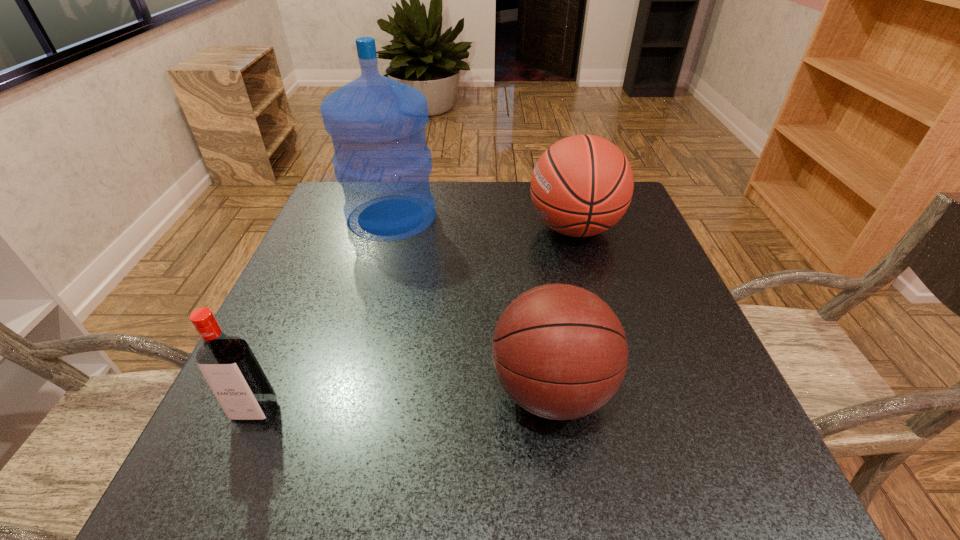
At what (x,y) coordinates should I click in order to perform the action: click on vacant space at the left edge of the desktop. Please return your answer as a coordinate pair (x, y). The image size is (960, 540). Looking at the image, I should click on (331, 335).

You are a GUI agent. You are given a task and a screenshot of the screen. Output one action in this format:
    pyautogui.click(x=<x>, y=<y>)
    Task: Click on the blank space at the right edge of the desktop
    This screenshot has width=960, height=540.
    Given the screenshot: What is the action you would take?
    pyautogui.click(x=584, y=241)

Where is `vacant region at the near left corner of the desktop`? This screenshot has height=540, width=960. vacant region at the near left corner of the desktop is located at coordinates (187, 475).

Find the location of `unoccupied area between the farther basketball and the vodka`. unoccupied area between the farther basketball and the vodka is located at coordinates (415, 320).

Find the location of a particular element. The image size is (960, 540). empty space between the farther basketball and the vodka is located at coordinates (415, 320).

Locate an element on the screen. vacant region between the nearer basketball and the tallest object is located at coordinates (471, 303).

Where is `vacant space in between the farther basketball and the vodka`? This screenshot has width=960, height=540. vacant space in between the farther basketball and the vodka is located at coordinates (415, 320).

You are a GUI agent. You are given a task and a screenshot of the screen. Output one action in this format:
    pyautogui.click(x=<x>, y=<y>)
    Task: Click on the free space between the water jug and the vodka
    Image resolution: width=960 pixels, height=540 pixels.
    Given the screenshot: What is the action you would take?
    pyautogui.click(x=324, y=314)

The image size is (960, 540). Find the location of `blank region between the farther basketball and the vodka`. blank region between the farther basketball and the vodka is located at coordinates (415, 320).

This screenshot has height=540, width=960. I want to click on vacant area that lies between the water jug and the vodka, so click(324, 314).